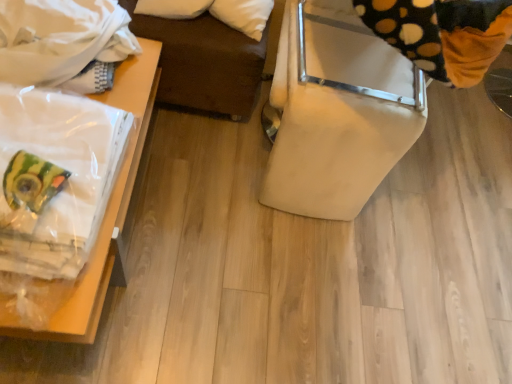
Question: In the image, is clear plastic bag at left, placed as the 2th furniture when sorted from right to left, positioned in front of or behind white cotton blanket at upper left?

Choices:
 (A) behind
 (B) front

Answer: (B)

Question: Is clear plastic bag at left, placed as the 2th furniture when sorted from right to left, to the left or to the right of white cotton blanket at upper left in the image?

Choices:
 (A) left
 (B) right

Answer: (B)

Question: Which object is positioned closest to the beige fabric chair at right, which is counted as the second furniture, starting from the left?

Choices:
 (A) white cotton blanket at upper left
 (B) black dotted fabric at upper right
 (C) clear plastic bag at left, placed as the 2th furniture when sorted from right to left

Answer: (B)

Question: Which is nearer to the black dotted fabric at upper right?

Choices:
 (A) beige fabric chair at right, which is counted as the second furniture, starting from the left
 (B) clear plastic bag at left, placed as the 2th furniture when sorted from right to left
 (C) white cotton blanket at upper left

Answer: (A)